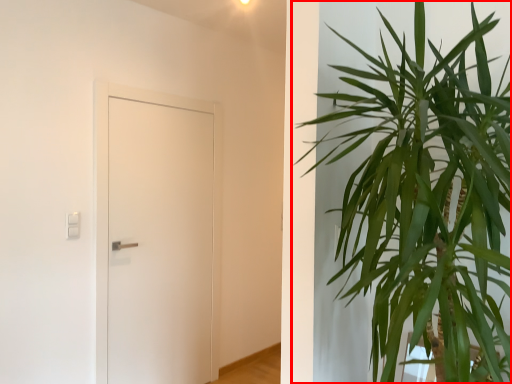
Question: From the image's perspective, where is houseplant (annotated by the red box) located relative to door?

Choices:
 (A) below
 (B) above

Answer: (B)